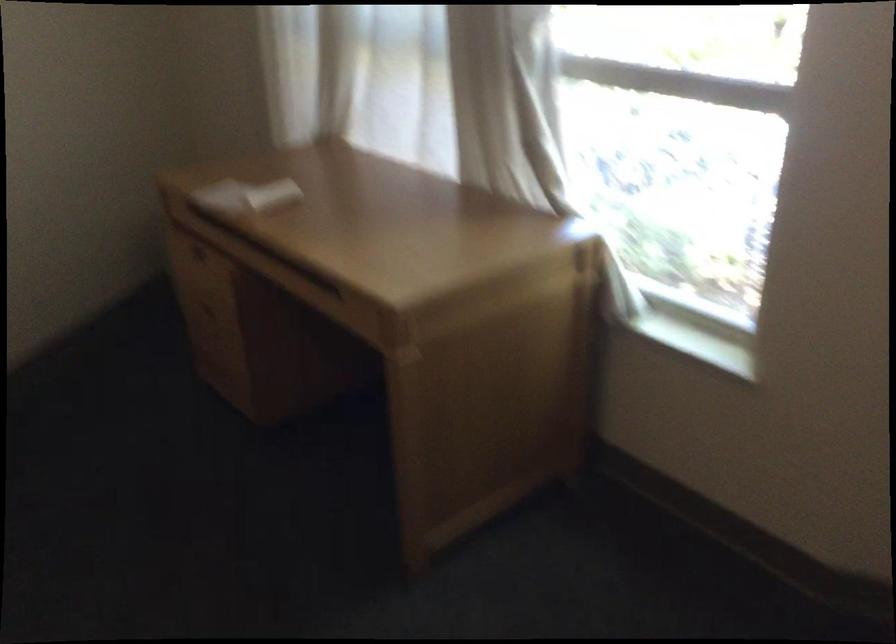
At what (x,y) coordinates should I click in order to perform the action: click on drawer pull. Please return your answer as a coordinate pair (x, y). Looking at the image, I should click on (332, 289).